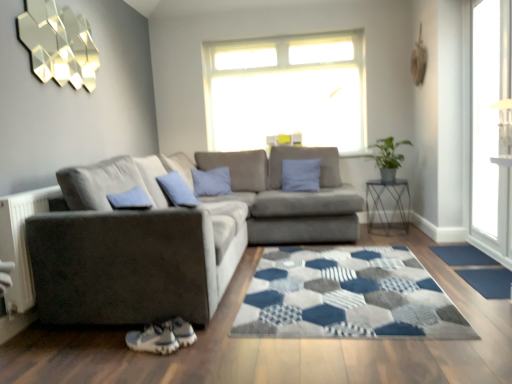
Question: Visually, is metallic wire table at right positioned to the left or to the right of green leafy plant at right?

Choices:
 (A) right
 (B) left

Answer: (A)

Question: Considering the positions of point (398, 183) and point (388, 147), is point (398, 183) closer or farther from the camera than point (388, 147)?

Choices:
 (A) closer
 (B) farther

Answer: (B)

Question: Which of these objects is positioned closest to the transparent glass door at right?

Choices:
 (A) blue fabric doormat at lower right, which is counted as the second doormat, starting from the back
 (B) suede gray couch at center
 (C) white mesh shoe at lower left
 (D) metallic wire table at right
 (E) blue fabric doormat at lower right, arranged as the second doormat when viewed from the front

Answer: (E)

Question: Estimate the real-world distances between objects in this image. Which object is closer to the suede gray couch at center?

Choices:
 (A) metallic wire table at right
 (B) white mesh shoe at lower left
 (C) blue fabric pillow at center
 (D) blue fabric doormat at lower right, arranged as the second doormat when viewed from the front
 (E) green leafy plant at right

Answer: (B)